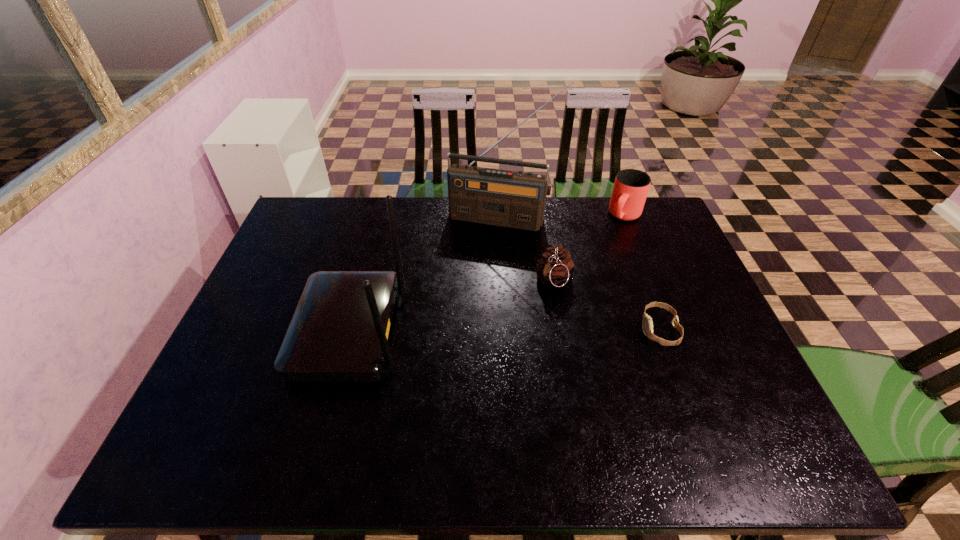
You are a GUI agent. You are given a task and a screenshot of the screen. Output one action in this format:
    pyautogui.click(x=<x>, y=<y>)
    Task: Click on the free space located on the face of the shortest object
    This screenshot has width=960, height=540.
    Given the screenshot: What is the action you would take?
    pyautogui.click(x=595, y=330)

This screenshot has height=540, width=960. I want to click on vacant space located 0.350m on the face of the shortest object, so click(507, 330).

Locate an element on the screen. The width and height of the screenshot is (960, 540). vacant space located on the handle side of the cup is located at coordinates (576, 293).

Identify the location of vacant space located on the handle side of the cup. The width and height of the screenshot is (960, 540). (577, 291).

Where is `free space located 0.400m on the handle side of the cup`? This screenshot has height=540, width=960. free space located 0.400m on the handle side of the cup is located at coordinates (570, 302).

I want to click on vacant region located 0.300m on the front-facing side of the radio receiver, so click(467, 295).

Identify the location of free space located on the front-facing side of the radio receiver. This screenshot has height=540, width=960. (469, 288).

Identify the location of vacant space located on the front-facing side of the radio receiver. (467, 295).

The width and height of the screenshot is (960, 540). I want to click on vacant space located with a leaf charm attached to the pinecone, so pyautogui.click(x=475, y=408).

Identify the location of vacant region located 0.120m with a leaf charm attached to the pinecone. (529, 324).